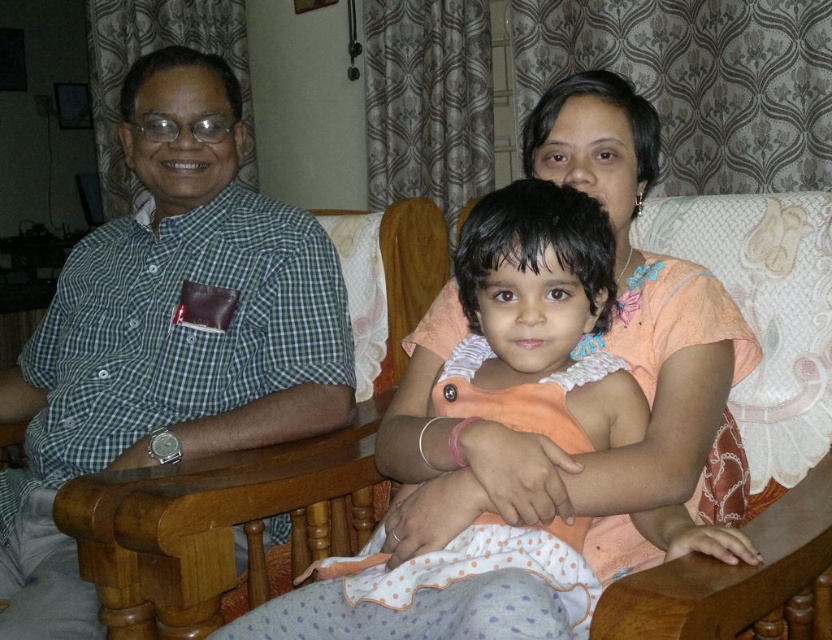
Question: Where is green checkered shirt at left located in relation to light orange fabric dress at center in the image?

Choices:
 (A) right
 (B) left

Answer: (B)

Question: Which point is farther from the camera taking this photo?

Choices:
 (A) (63, 577)
 (B) (404, 580)

Answer: (A)

Question: Which point is closer to the camera?

Choices:
 (A) (588, 316)
 (B) (53, 371)

Answer: (A)

Question: Does green checkered shirt at left appear on the left side of light orange fabric dress at center?

Choices:
 (A) no
 (B) yes

Answer: (B)

Question: Does green checkered shirt at left have a smaller size compared to light orange fabric dress at center?

Choices:
 (A) no
 (B) yes

Answer: (A)